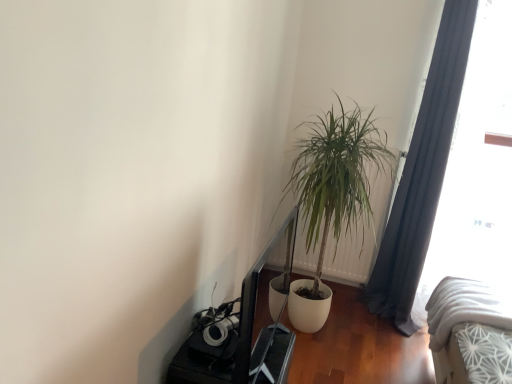
Identify the location of free location in front of dark gray fabric curtain at right. The image size is (512, 384). pos(386,331).